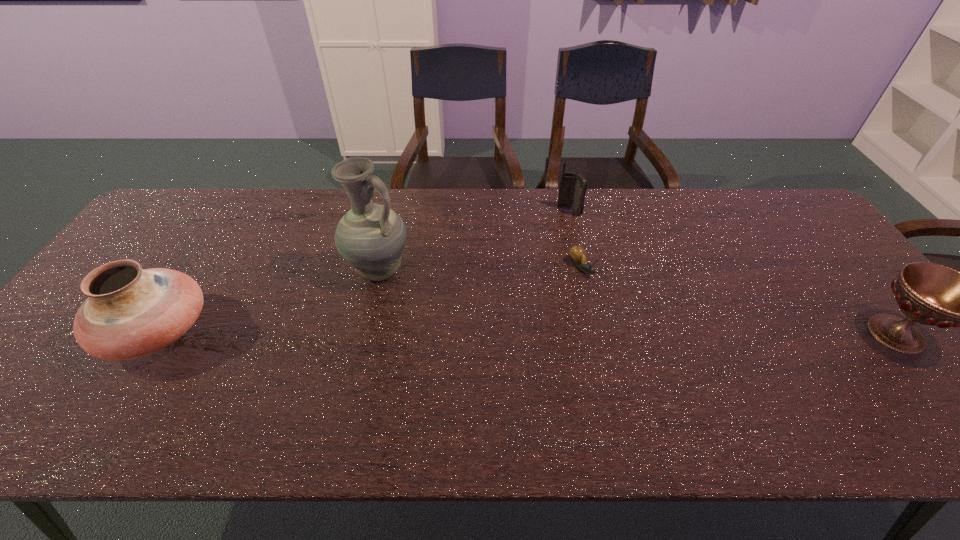
Locate an element on the screen. The width and height of the screenshot is (960, 540). vacant space that satisfies the following two spatial constraints: 1. on the back side of the second object from left to right; 2. on the left side of the leftmost object is located at coordinates (197, 270).

This screenshot has width=960, height=540. Identify the location of free space that satisfies the following two spatial constraints: 1. on the back side of the shortest object; 2. on the left side of the farthest object. (568, 211).

At what (x,y) coordinates should I click in order to perform the action: click on blank area in the image that satisfies the following two spatial constraints: 1. on the front side of the farthest object; 2. on the left side of the rightmost object. Please return your answer as a coordinate pair (x, y). The width and height of the screenshot is (960, 540). Looking at the image, I should click on (597, 334).